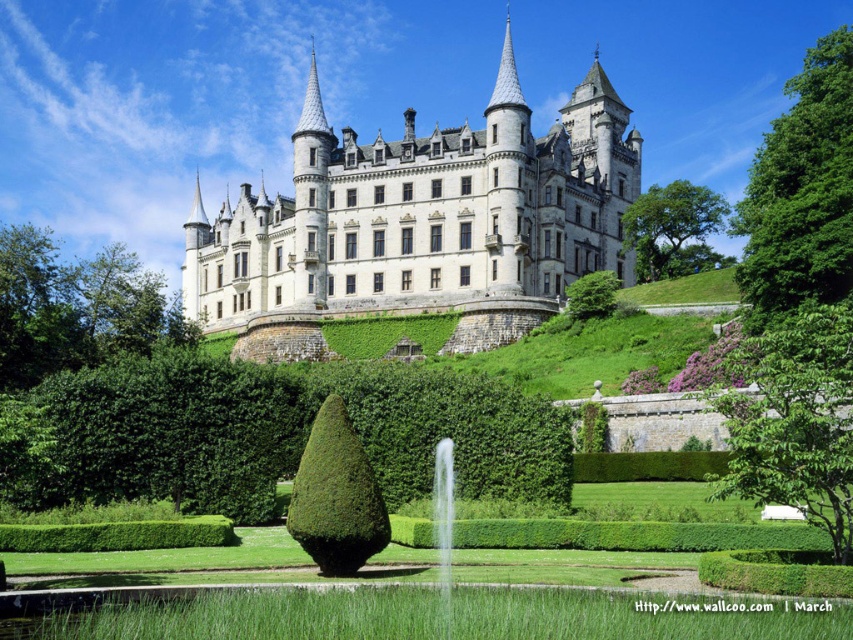
Which is more to the right, white stone castle at center or green leafy hedge at center?

From the viewer's perspective, white stone castle at center appears more on the right side.

Is white stone castle at center smaller than green leafy hedge at center?

No, white stone castle at center is not smaller than green leafy hedge at center.

The height and width of the screenshot is (640, 853). Describe the element at coordinates (421, 224) in the screenshot. I see `white stone castle at center` at that location.

Where is `white stone castle at center`? This screenshot has width=853, height=640. white stone castle at center is located at coordinates (421, 224).